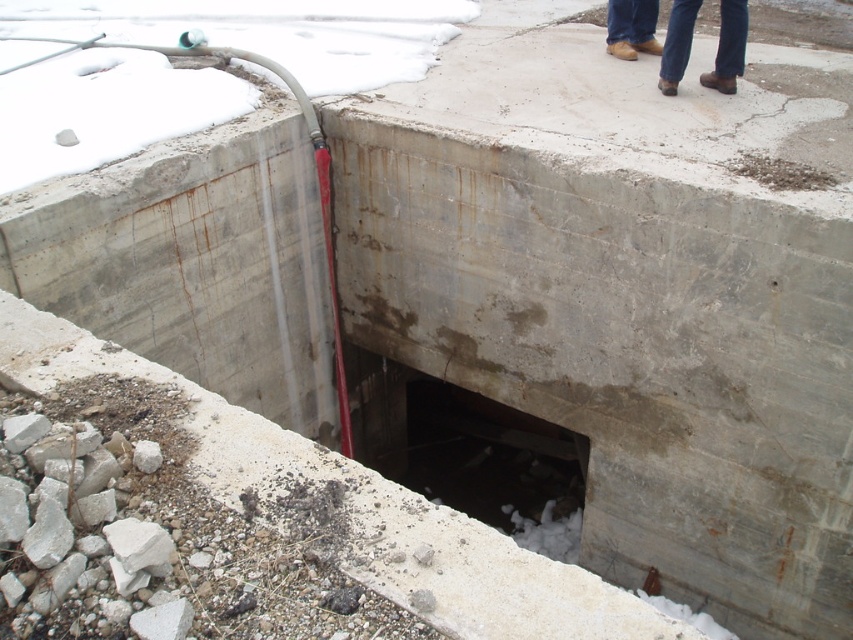
Question: Does dark concrete hole at center appear on the left side of brown leather shoes at upper right?

Choices:
 (A) yes
 (B) no

Answer: (A)

Question: Which point is closer to the camera?

Choices:
 (A) (635, 10)
 (B) (445, 428)

Answer: (A)

Question: Which of the following is the farthest from the observer?

Choices:
 (A) click(x=654, y=28)
 (B) click(x=485, y=474)

Answer: (B)

Question: Which point is farther to the camera?

Choices:
 (A) (x=674, y=19)
 (B) (x=355, y=452)

Answer: (B)

Question: Can you confirm if brown leather shoes at upper center is smaller than brown leather shoes at upper right?

Choices:
 (A) yes
 (B) no

Answer: (B)

Question: Is the position of dark concrete hole at center less distant than that of brown leather shoes at upper right?

Choices:
 (A) yes
 (B) no

Answer: (A)